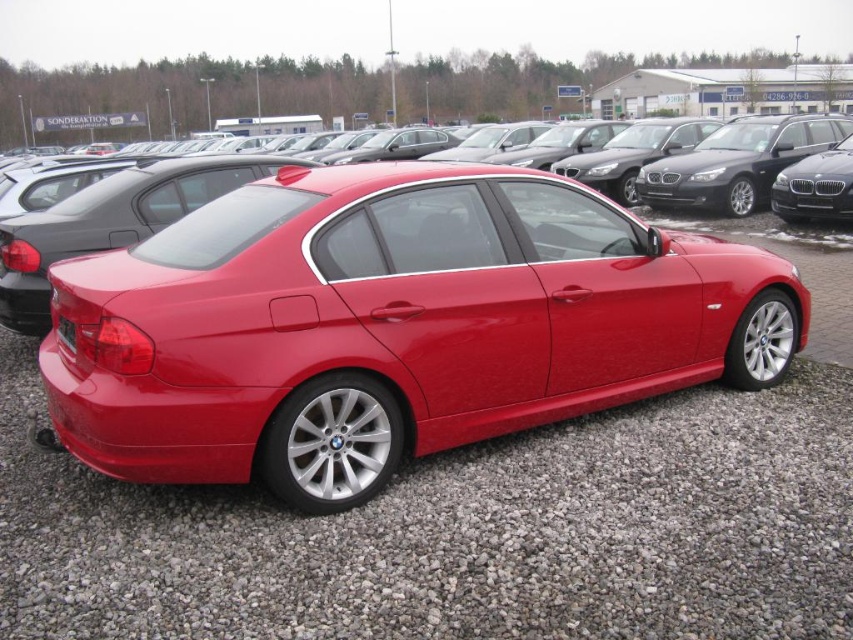
Which is behind, point (403, 582) or point (67, 321)?

The point (67, 321) is more distant.

The height and width of the screenshot is (640, 853). Describe the element at coordinates (460, 532) in the screenshot. I see `red gravel at lower center` at that location.

Does point (57, 600) come farther from viewer compared to point (61, 339)?

That is False.

Where is `red gravel at lower center`? The height and width of the screenshot is (640, 853). red gravel at lower center is located at coordinates (460, 532).

This screenshot has height=640, width=853. What do you see at coordinates (392, 324) in the screenshot?
I see `glossy metallic sedan at center` at bounding box center [392, 324].

Is glossy metallic sedan at center shorter than black plastic license plate at rear?

No.

Is point (343, 493) farther from camera compared to point (74, 348)?

That is True.

Locate an element on the screen. The width and height of the screenshot is (853, 640). glossy metallic sedan at center is located at coordinates (392, 324).

Is glossy metallic sedan at center to the left of red gravel at lower center from the viewer's perspective?

Incorrect, glossy metallic sedan at center is not on the left side of red gravel at lower center.

Locate an element on the screen. This screenshot has height=640, width=853. glossy metallic sedan at center is located at coordinates (392, 324).

I want to click on glossy metallic sedan at center, so click(392, 324).